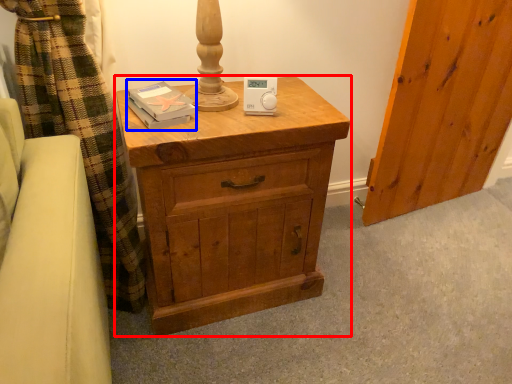
Question: Among these objects, which one is farthest to the camera, chest of drawers (highlighted by a red box) or book (highlighted by a blue box)?

Choices:
 (A) chest of drawers
 (B) book

Answer: (B)